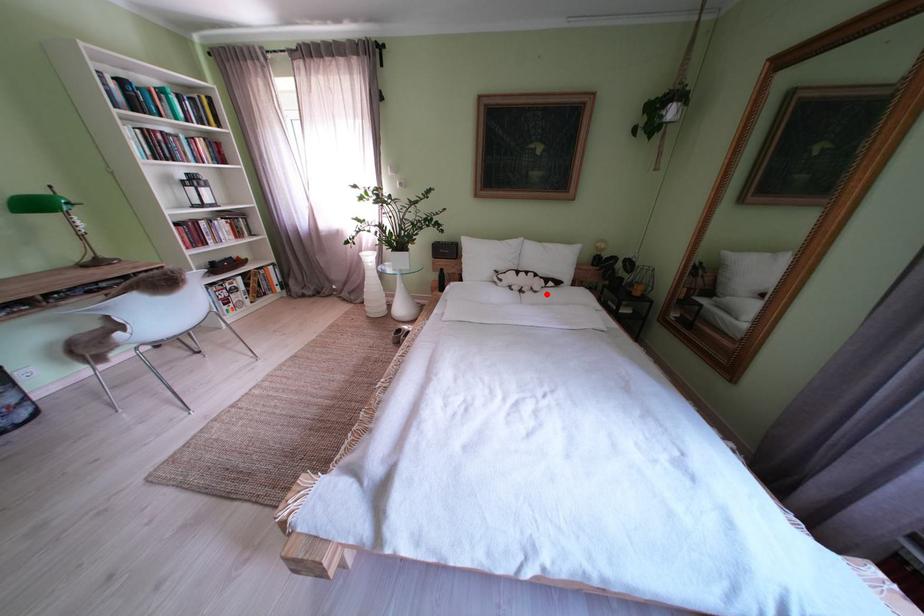
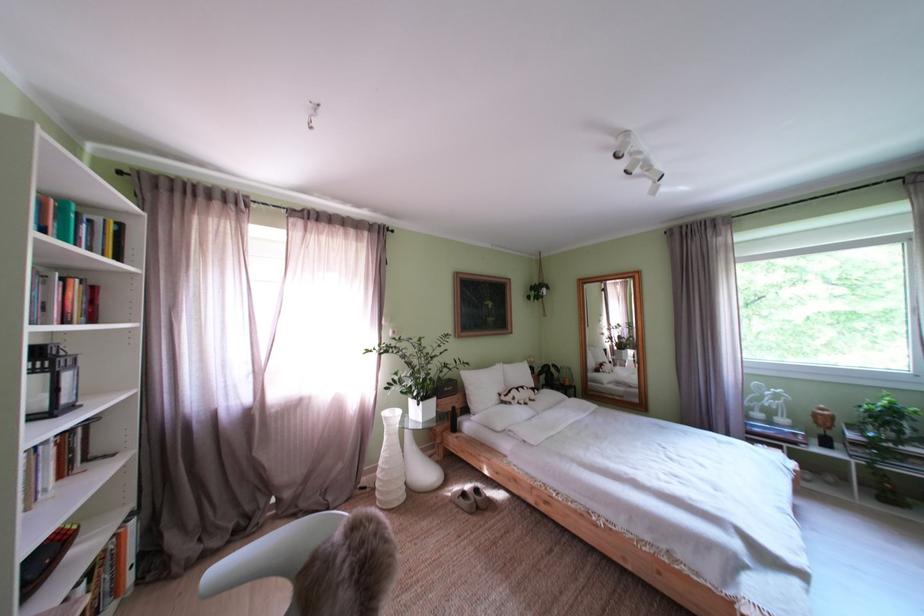
Question: A red point is marked in image1. In image2, is the corresponding 3D point closer to the camera or farther? Reply with the corresponding letter.

Choices:
 (A) The corresponding 3D point is closer.
 (B) The corresponding 3D point is farther.

Answer: (B)